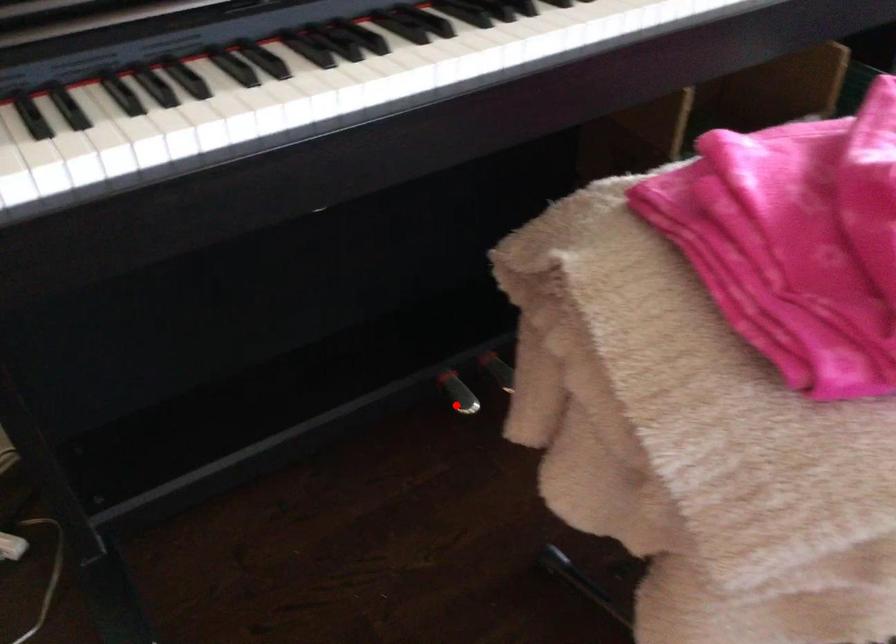
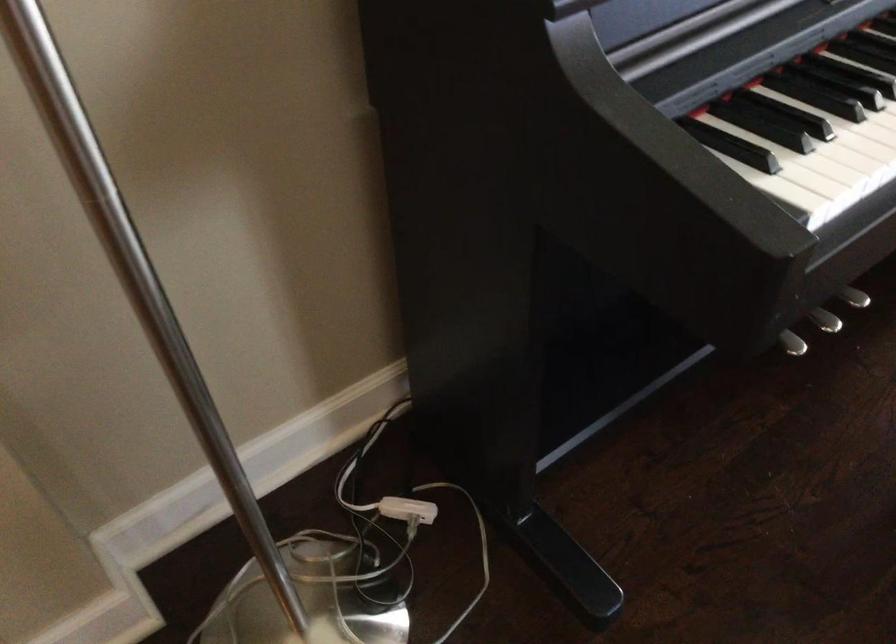
Find the pixel in the second image that matches the highlighted location in the first image.

(791, 343)